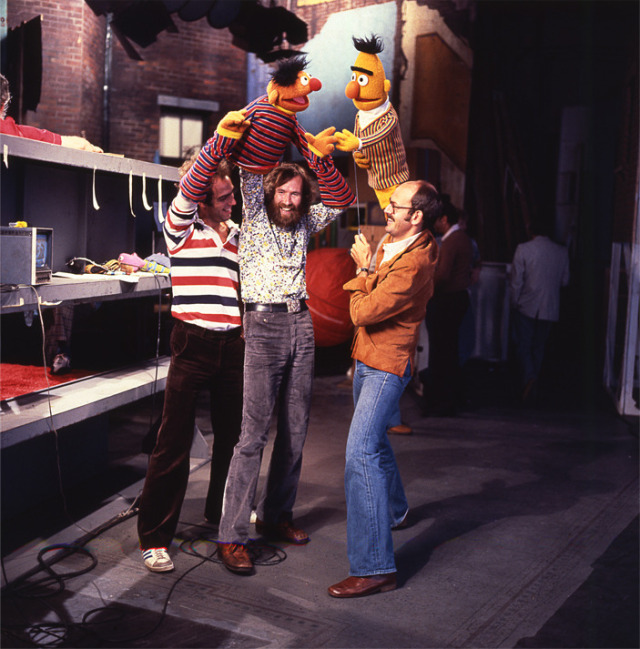
The height and width of the screenshot is (649, 640). In order to click on gray rug in this screenshot , I will do `click(505, 511)`.